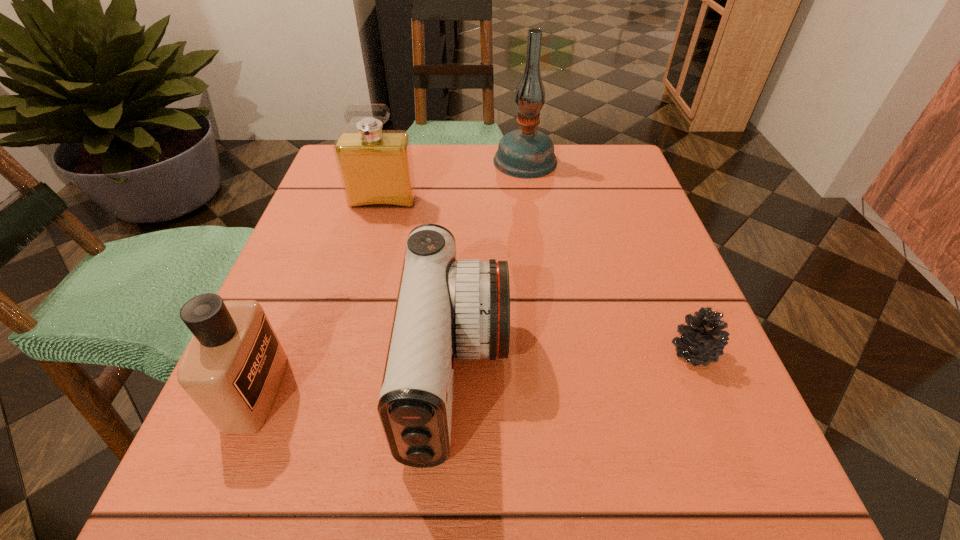
At what (x,y) coordinates should I click in order to perform the action: click on free space between the pinecone and the shorter perfume. Please return your answer as a coordinate pair (x, y). The width and height of the screenshot is (960, 540). Looking at the image, I should click on (474, 372).

Identify the location of the closest object to the farther perfume. 526,153.

This screenshot has width=960, height=540. In order to click on object that is the fourth closest one to the nearer perfume in this screenshot , I will do `click(526, 153)`.

Where is `free space that satisfies the following two spatial constraints: 1. on the front-facing side of the farther perfume; 2. on the front label of the nearer perfume`? free space that satisfies the following two spatial constraints: 1. on the front-facing side of the farther perfume; 2. on the front label of the nearer perfume is located at coordinates (333, 391).